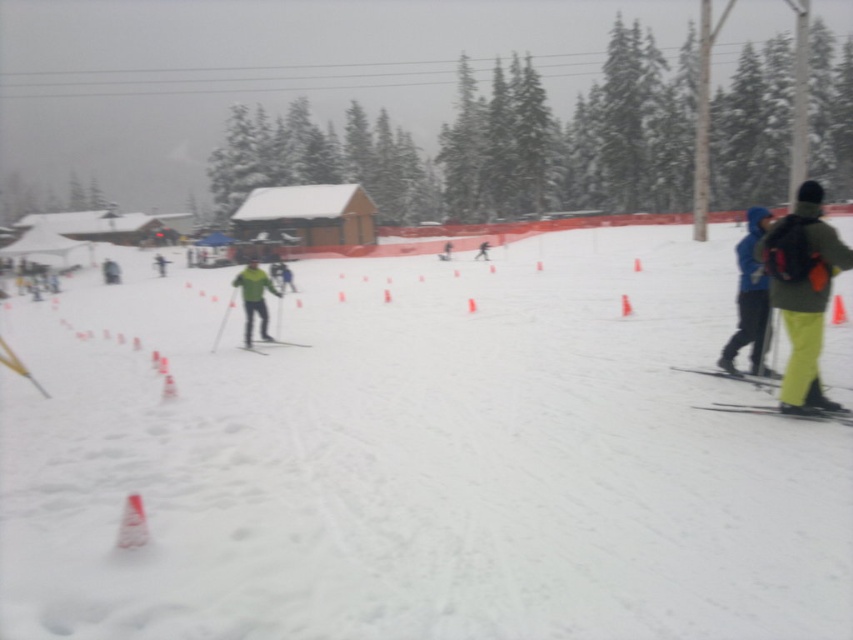
Between green fabric jacket at right and green matte jacket at center, which one is positioned higher?

green matte jacket at center

Is point (820, 221) farther from viewer compared to point (260, 333)?

No, (820, 221) is in front of (260, 333).

Based on the photo, who is more forward, (811, 252) or (236, 284)?

Point (811, 252) is in front.

Find the location of a particular element. The image size is (853, 640). green fabric jacket at right is located at coordinates (804, 292).

Who is shorter, yellow matte ski at lower right or matte green ski at center?

Standing shorter between the two is yellow matte ski at lower right.

Is yellow matte ski at lower right to the right of matte green ski at center from the viewer's perspective?

Yes, yellow matte ski at lower right is to the right of matte green ski at center.

Is point (764, 412) in front of point (254, 352)?

Yes.

This screenshot has width=853, height=640. Identify the location of yellow matte ski at lower right. (784, 412).

Does blue fleece jacket at right appear on the left side of yellow matte ski at lower right?

No, blue fleece jacket at right is not to the left of yellow matte ski at lower right.

Is blue fleece jacket at right thinner than yellow matte ski at lower right?

No.

Is point (751, 268) closer to camera compared to point (753, 412)?

No, (751, 268) is behind (753, 412).

Where is `blue fleece jacket at right`? This screenshot has width=853, height=640. blue fleece jacket at right is located at coordinates (749, 298).